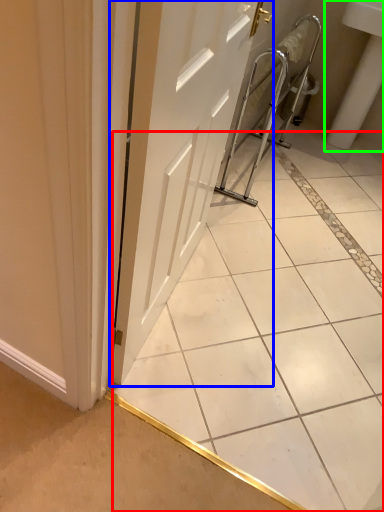
Question: Based on their relative distances, which object is farther from ceramic tile (highlighted by a red box)? Choose from door (highlighted by a blue box) and sink (highlighted by a green box).

Choices:
 (A) door
 (B) sink

Answer: (B)